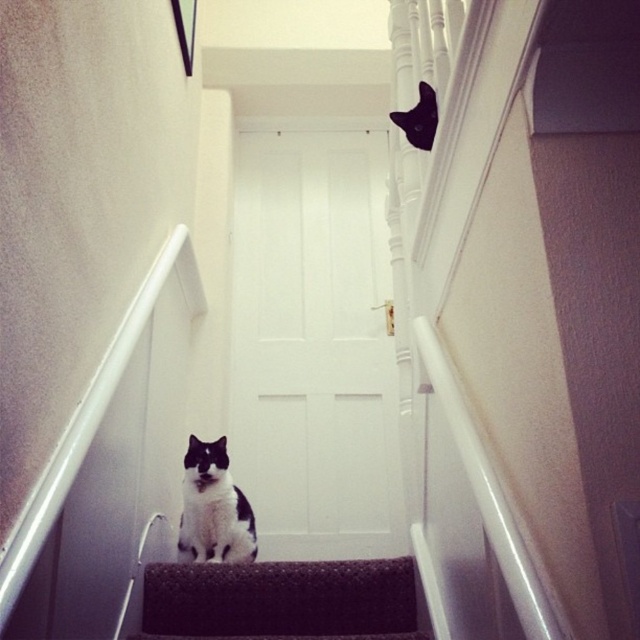
Based on the photo, is dark carpeted stair at center thinner than black and white fur cat at center?

No, dark carpeted stair at center is not thinner than black and white fur cat at center.

Can you confirm if dark carpeted stair at center is bigger than black and white fur cat at center?

Correct, dark carpeted stair at center is larger in size than black and white fur cat at center.

At what (x,y) coordinates should I click in order to perform the action: click on dark carpeted stair at center. Please return your answer as a coordinate pair (x, y). Looking at the image, I should click on (282, 600).

Find the location of a particular element. dark carpeted stair at center is located at coordinates (282, 600).

Who is lower down, black and white fur cat at center or black fur cat at upper center?

black and white fur cat at center is lower down.

Who is taller, black and white fur cat at center or black fur cat at upper center?

With more height is black and white fur cat at center.

Is point (218, 545) closer to camera compared to point (406, 112)?

That is False.

The width and height of the screenshot is (640, 640). Find the location of `black and white fur cat at center`. black and white fur cat at center is located at coordinates (212, 508).

Which is behind, point (333, 636) or point (413, 118)?

The point (413, 118) is more distant.

Between dark carpeted stair at center and black fur cat at upper center, which one has less height?

Standing shorter between the two is dark carpeted stair at center.

Is point (211, 586) less distant than point (401, 120)?

That is True.

The image size is (640, 640). Find the location of `dark carpeted stair at center`. dark carpeted stair at center is located at coordinates (282, 600).